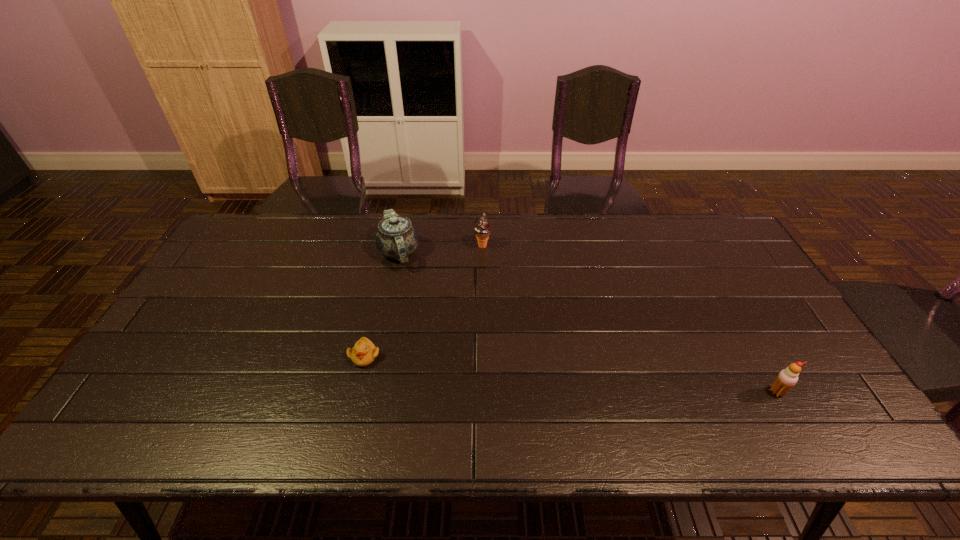
What are the coordinates of `free spot located at the beak of the second nearest object` in the screenshot? It's located at (346, 435).

I want to click on chinaware present at the far edge, so pyautogui.click(x=396, y=238).

This screenshot has width=960, height=540. Find the location of `icecream situated at the far edge`. icecream situated at the far edge is located at coordinates (482, 229).

At what (x,y) coordinates should I click in order to perform the action: click on object that is at the right edge. Please return your answer as a coordinate pair (x, y). Image resolution: width=960 pixels, height=540 pixels. Looking at the image, I should click on (787, 378).

Locate an element on the screen. The width and height of the screenshot is (960, 540). vacant space at the far edge of the desktop is located at coordinates (321, 241).

You are a GUI agent. You are given a task and a screenshot of the screen. Output one action in this format:
    pyautogui.click(x=<x>, y=<y>)
    Task: Click on the blank space at the near edge of the desktop
    
    Given the screenshot: What is the action you would take?
    pyautogui.click(x=205, y=429)

At what (x,y) coordinates should I click in order to perform the action: click on vacant space at the left edge of the desktop. Please return your answer as a coordinate pair (x, y). This screenshot has height=540, width=960. Looking at the image, I should click on (252, 276).

This screenshot has width=960, height=540. I want to click on free location at the right edge, so click(722, 281).

Locate an element on the screen. The width and height of the screenshot is (960, 540). free space at the far left corner is located at coordinates (244, 236).

The image size is (960, 540). In the image, there is a desktop. Find the location of `vacant space at the near left corner`. vacant space at the near left corner is located at coordinates (176, 422).